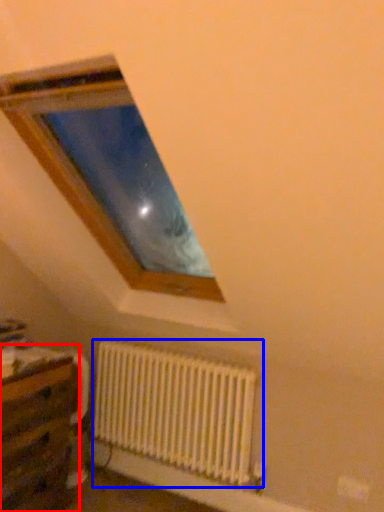
Question: Among these objects, which one is farthest to the camera, table (highlighted by a red box) or radiator (highlighted by a blue box)?

Choices:
 (A) table
 (B) radiator

Answer: (B)